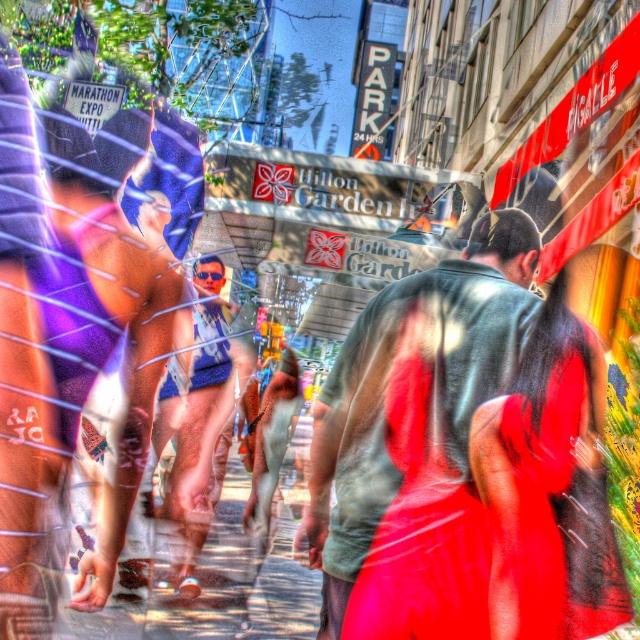
You are a photographer trying to capture the vibrant red dress in the crowd. You notice a point marked at coordinates (435, 385). What object is located at this point?

The object at point (435, 385) is the green fabric shirt at center.

You are standing on the smooth concrete sidewalk at center and looking up. Can you see the green fabric shirt at center from your current position?

Yes, the green fabric shirt at center is located above the smooth concrete sidewalk at center, so you can see it while standing on the sidewalk and looking upward.

You are a photographer trying to capture the vibrant atmosphere of the bustling street. You notice the green fabric shirt at center and the smooth concrete sidewalk at center. Which object should you focus on to ensure it appears more prominent in your photo?

The green fabric shirt at center is larger in size than the smooth concrete sidewalk at center, so focusing on the green fabric shirt at center will make it appear more prominent in the photo.